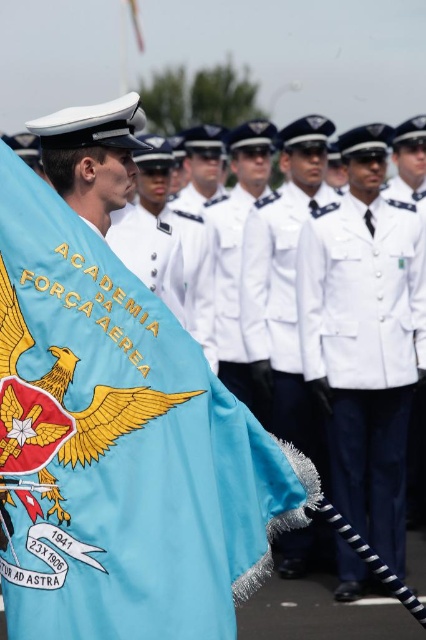
Question: Does light blue fabric flag at center come behind white matte uniform at center?

Choices:
 (A) no
 (B) yes

Answer: (A)

Question: Which point is farther to the camera?

Choices:
 (A) (403, 472)
 (B) (235, 636)

Answer: (A)

Question: Can you confirm if light blue fabric flag at center is positioned above white matte uniform at center?

Choices:
 (A) yes
 (B) no

Answer: (A)

Question: Can you confirm if light blue fabric flag at center is thinner than white matte uniform at center?

Choices:
 (A) yes
 (B) no

Answer: (B)